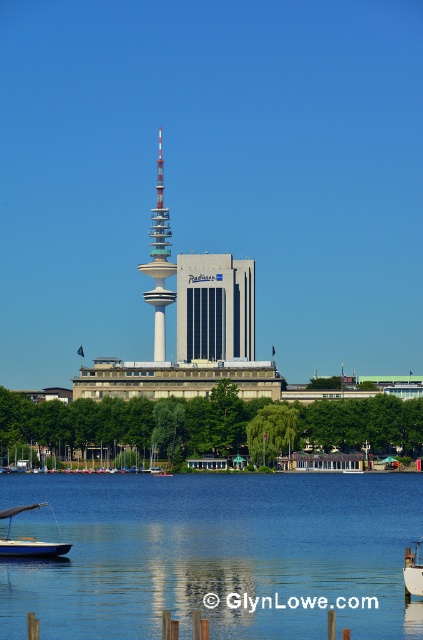
Does white painted steel tower at center appear on the left side of blue matte sailboat at lower left?

In fact, white painted steel tower at center is to the right of blue matte sailboat at lower left.

Which of these two, white painted steel tower at center or blue matte sailboat at lower left, stands taller?

Standing taller between the two is white painted steel tower at center.

Is point (161, 172) positioned behind point (16, 554)?

Yes, point (161, 172) is farther from viewer.

Image resolution: width=423 pixels, height=640 pixels. I want to click on white painted steel tower at center, so click(159, 260).

Is point (197, 316) in front of point (35, 544)?

Yes.

Can you confirm if matte glass building at center is shorter than blue matte sailboat at lower left?

Incorrect, matte glass building at center's height does not fall short of blue matte sailboat at lower left's.

In the scene shown: Who is more distant from viewer, (222, 307) or (51, 544)?

The point (51, 544) is behind.

Locate an element on the screen. matte glass building at center is located at coordinates (214, 307).

Can you confirm if blue liquid water at center is positioned to the left of blue matte sailboat at lower left?

Incorrect, blue liquid water at center is not on the left side of blue matte sailboat at lower left.

Who is more distant from viewer, (395, 513) or (29, 548)?

Positioned behind is point (395, 513).

The width and height of the screenshot is (423, 640). In order to click on blue liquid water at center in this screenshot , I will do `click(214, 554)`.